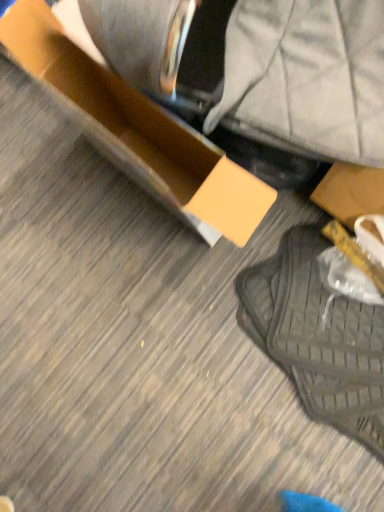
Question: Is black mesh bag at lower right facing towards matte cardboard box at center?

Choices:
 (A) no
 (B) yes

Answer: (A)

Question: Can you confirm if black mesh bag at lower right is shorter than matte cardboard box at center?

Choices:
 (A) no
 (B) yes

Answer: (B)

Question: Considering the relative sizes of black mesh bag at lower right and matte cardboard box at center in the image provided, is black mesh bag at lower right wider than matte cardboard box at center?

Choices:
 (A) yes
 (B) no

Answer: (A)

Question: From the image's perspective, is black mesh bag at lower right located above matte cardboard box at center?

Choices:
 (A) yes
 (B) no

Answer: (B)

Question: Is black mesh bag at lower right positioned before matte cardboard box at center?

Choices:
 (A) yes
 (B) no

Answer: (B)

Question: Can you confirm if black mesh bag at lower right is positioned to the left of matte cardboard box at center?

Choices:
 (A) no
 (B) yes

Answer: (A)

Question: Can you confirm if matte cardboard box at center is smaller than black mesh bag at lower right?

Choices:
 (A) no
 (B) yes

Answer: (A)

Question: Is matte cardboard box at center oriented away from black mesh bag at lower right?

Choices:
 (A) yes
 (B) no

Answer: (B)

Question: Is the position of matte cardboard box at center more distant than that of black mesh bag at lower right?

Choices:
 (A) yes
 (B) no

Answer: (B)

Question: Is matte cardboard box at center far from black mesh bag at lower right?

Choices:
 (A) no
 (B) yes

Answer: (A)

Question: Can you confirm if matte cardboard box at center is shorter than black mesh bag at lower right?

Choices:
 (A) no
 (B) yes

Answer: (A)

Question: Is black mesh bag at lower right a part of matte cardboard box at center?

Choices:
 (A) yes
 (B) no

Answer: (B)

Question: Is matte cardboard box at center wider or thinner than black mesh bag at lower right?

Choices:
 (A) wide
 (B) thin

Answer: (B)